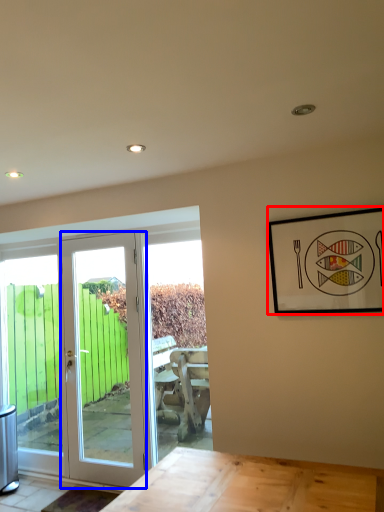
Question: Which object appears closest to the camera in this image, picture frame (highlighted by a red box) or door (highlighted by a blue box)?

Choices:
 (A) picture frame
 (B) door

Answer: (A)